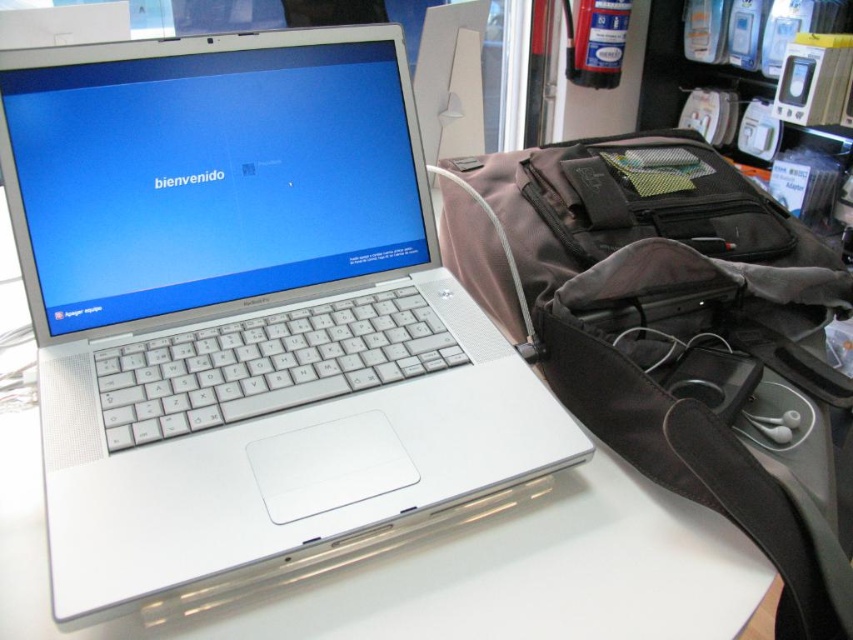
Question: Which of the following is the closest to the observer?

Choices:
 (A) gray fabric backpack at right
 (B) silver metallic laptop at center

Answer: (B)

Question: Which object appears closest to the camera in this image?

Choices:
 (A) gray fabric backpack at right
 (B) silver metallic laptop at center

Answer: (B)

Question: Does silver metallic laptop at center appear over gray fabric backpack at right?

Choices:
 (A) no
 (B) yes

Answer: (B)

Question: Is silver metallic laptop at center below gray fabric backpack at right?

Choices:
 (A) yes
 (B) no

Answer: (B)

Question: Considering the relative positions of silver metallic laptop at center and gray fabric backpack at right in the image provided, where is silver metallic laptop at center located with respect to gray fabric backpack at right?

Choices:
 (A) below
 (B) above

Answer: (B)